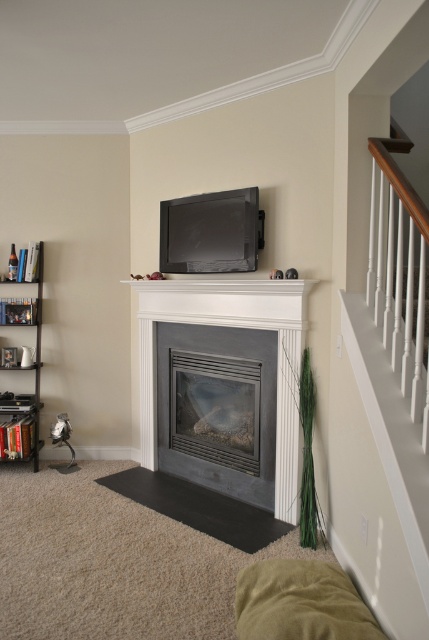
Can you confirm if white glossy fireplace at center is wider than metallic silver bookshelf at left?

Indeed, white glossy fireplace at center has a greater width compared to metallic silver bookshelf at left.

Is point (262, 308) positioned in front of point (11, 417)?

Yes, point (262, 308) is in front of point (11, 417).

Identify the location of white glossy fireplace at center. The width and height of the screenshot is (429, 640). (232, 326).

Who is taller, matte black fireplace at center or matte black tv at upper center?

matte black fireplace at center is taller.

Does point (251, 353) come behind point (250, 230)?

Yes.

Where is `matte black fireplace at center`? This screenshot has width=429, height=640. matte black fireplace at center is located at coordinates pyautogui.click(x=217, y=408).

Who is more forward, (x=236, y=252) or (x=33, y=241)?

Point (x=236, y=252)

Can you confirm if matte black tv at upper center is shorter than metallic silver bookshelf at left?

Yes, matte black tv at upper center is shorter than metallic silver bookshelf at left.

Who is more forward, (211, 237) or (33, 275)?

Positioned in front is point (211, 237).

The width and height of the screenshot is (429, 640). What are the coordinates of `matte black tv at upper center` in the screenshot? It's located at (211, 232).